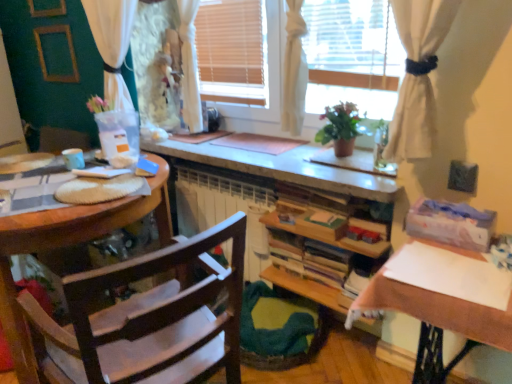
Where is `vacant space situated above white paper at right (from a real-world perspective)`? The width and height of the screenshot is (512, 384). vacant space situated above white paper at right (from a real-world perspective) is located at coordinates (455, 263).